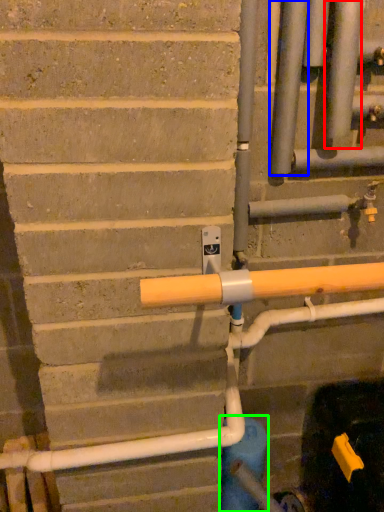
Question: Considering the real-world distances, which object is farthest from pipe (highlighted by a red box)? pipe (highlighted by a blue box) or water pipe (highlighted by a green box)?

Choices:
 (A) pipe
 (B) water pipe

Answer: (B)